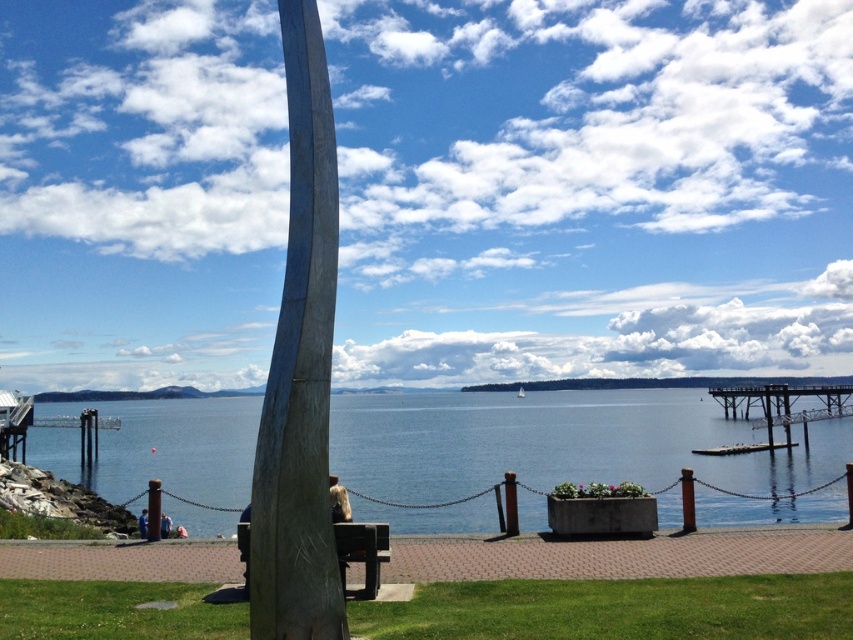
You are standing at the point marked by the coordinates point at (560,442). Looking around, you see the blue water at center. What direction should you walk to reach the curved wooden structure on the left side of the frame?

Since the curved wooden structure is on the left side of the frame and you are at the point indicating blue water at center, you should walk to your left to reach the curved wooden structure on the left side of the frame.

You are a photographer standing at the waterfront scene. You want to capture a photo of the wooden park bench at center and the blue water at center. Which object should you focus on first if you want to include both in your shot without moving the camera?

The blue water at center is below the wooden park bench at center, so you should focus on the wooden park bench at center first to ensure it stays in frame while capturing the blue water at center below it.